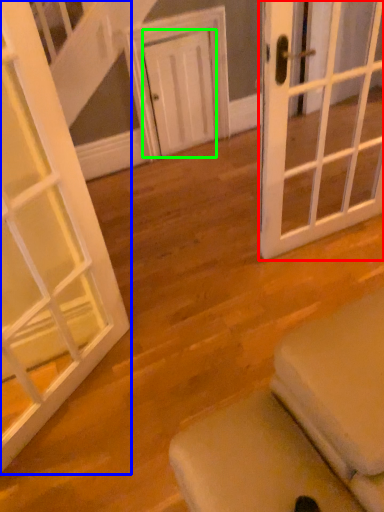
Question: Which is farther away from door (highlighted by a red box)? door (highlighted by a blue box) or door (highlighted by a green box)?

Choices:
 (A) door
 (B) door

Answer: (B)